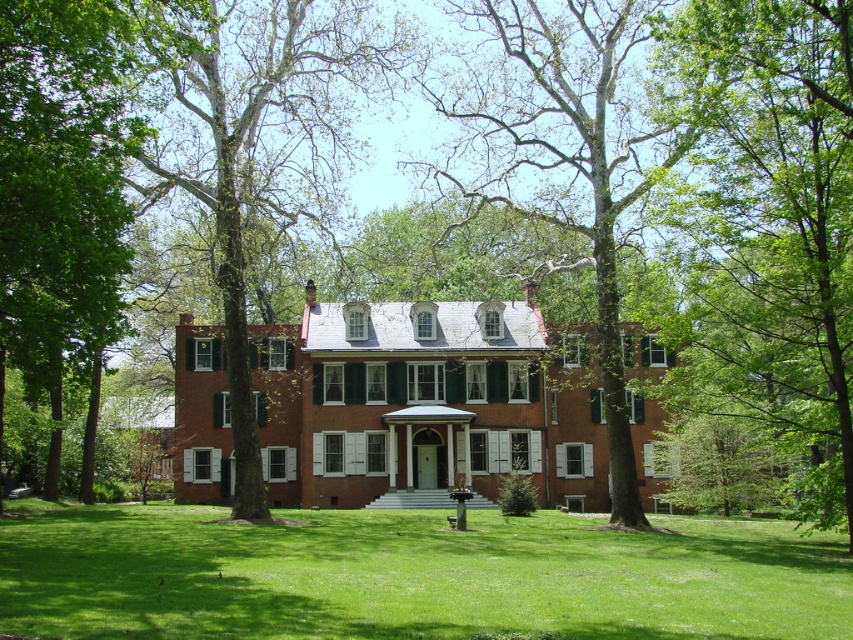
Between green grass at center and green leafy tree at left, which one is positioned higher?

Positioned higher is green leafy tree at left.

Which is in front, point (434, 556) or point (18, 348)?

Point (434, 556) is more forward.

You are a GUI agent. You are given a task and a screenshot of the screen. Output one action in this format:
    pyautogui.click(x=<x>, y=<y>)
    Task: Click on the green grass at center
    The image size is (853, 640).
    Given the screenshot: What is the action you would take?
    pyautogui.click(x=412, y=577)

Does green leafy tree at upper right have a lesser height compared to green leafy tree at center?

Yes.

Is green leafy tree at upper right closer to camera compared to green leafy tree at center?

Yes, green leafy tree at upper right is closer to the viewer.

Find the location of a particular element. green leafy tree at upper right is located at coordinates (770, 227).

Image resolution: width=853 pixels, height=640 pixels. I want to click on green leafy tree at upper right, so click(x=770, y=227).

Based on the photo, is green grass at center taller than green leafy tree at center?

No.

Where is `green grass at center`? The image size is (853, 640). green grass at center is located at coordinates (412, 577).

The image size is (853, 640). Identify the location of green grass at center. (412, 577).